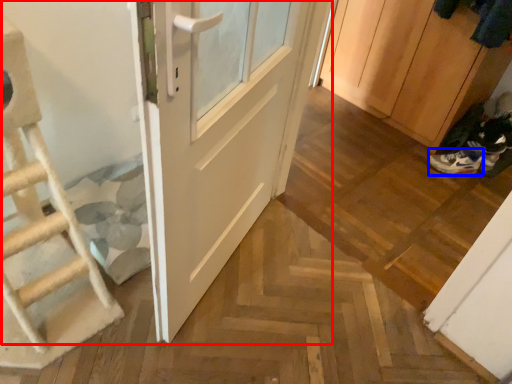
Question: Which point is closer to the camera, door (highlighted by a red box) or footwear (highlighted by a blue box)?

Choices:
 (A) door
 (B) footwear

Answer: (A)